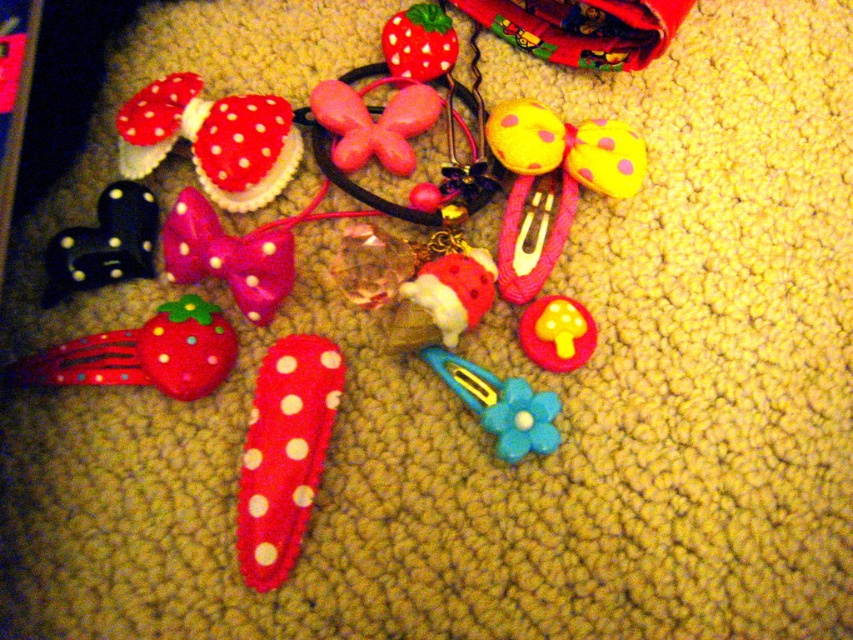
What are the coordinates of `polka dot fabric strawberry at upper left` in the screenshot? It's located at (212, 140).

Between point (268, 198) and point (386, 45), which one is positioned behind?

Point (386, 45)

Which is in front, point (215, 195) or point (447, 32)?

Point (215, 195) is more forward.

I want to click on polka dot fabric strawberry at upper left, so click(212, 140).

Is yellow polka dot bow at center above black felt bow at left?

Yes.

Who is shorter, yellow polka dot bow at center or black felt bow at left?

black felt bow at left

You are a GUI agent. You are given a task and a screenshot of the screen. Output one action in this format:
    pyautogui.click(x=<x>, y=<y>)
    Task: Click on the yellow polka dot bow at center
    
    Given the screenshot: What is the action you would take?
    tap(550, 184)

Is red felt hair clip at lower center wider than black felt bow at left?

No, red felt hair clip at lower center is not wider than black felt bow at left.

Is point (296, 486) more distant than point (113, 253)?

That is False.

What are the coordinates of `red felt hair clip at lower center` in the screenshot? It's located at (283, 452).